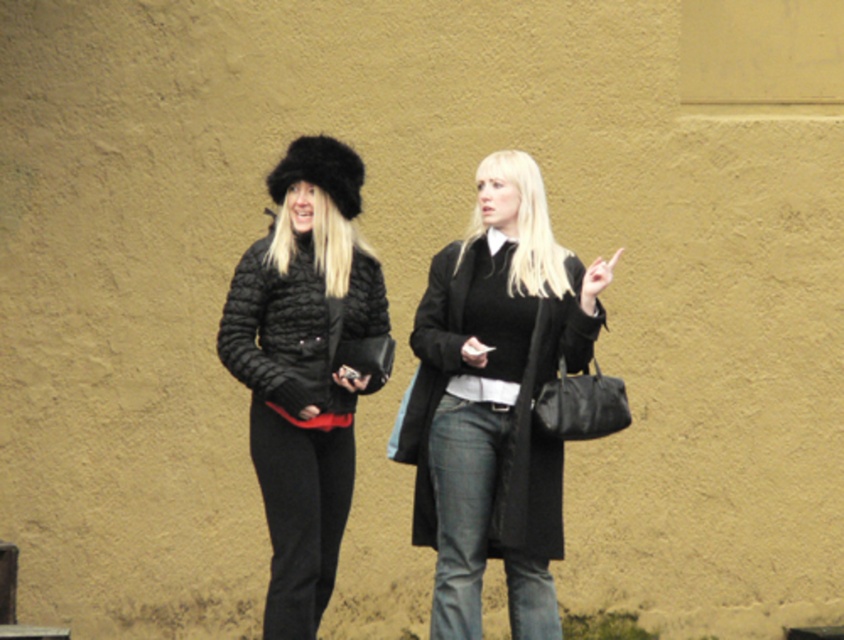
Does matte black fur hat at upper left have a lesser width compared to black matte coat at center?

Correct, matte black fur hat at upper left's width is less than black matte coat at center's.

At what (x,y) coordinates should I click in order to perform the action: click on matte black fur hat at upper left. Please return your answer as a coordinate pair (x, y). Image resolution: width=844 pixels, height=640 pixels. Looking at the image, I should click on (304, 369).

Does black matte coat at center appear on the left side of quilted black coat at center?

No, black matte coat at center is not to the left of quilted black coat at center.

Who is positioned more to the right, black matte coat at center or quilted black coat at center?

From the viewer's perspective, black matte coat at center appears more on the right side.

Between point (436, 264) and point (266, 248), which one is positioned in front?

Point (266, 248) is in front.

Locate an element on the screen. This screenshot has width=844, height=640. black matte coat at center is located at coordinates (537, 426).

Does matte black fur hat at upper left come behind quilted black coat at center?

Yes, it is.

Is matte black fur hat at upper left closer to the viewer compared to quilted black coat at center?

No, matte black fur hat at upper left is further to the viewer.

Who is more forward, (x=329, y=141) or (x=371, y=262)?

Point (x=329, y=141) is in front.

Identify the location of matte black fur hat at upper left. This screenshot has height=640, width=844. pyautogui.click(x=304, y=369).